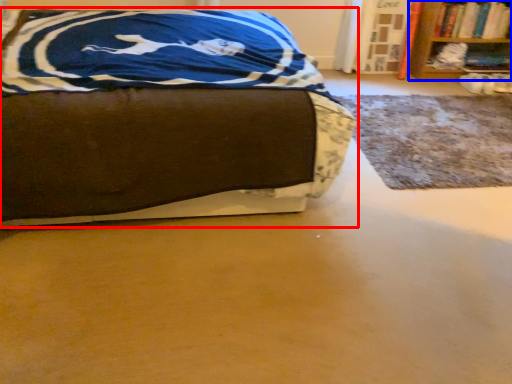
Question: Which point is closer to the camera, bed (highlighted by a red box) or bookcase (highlighted by a blue box)?

Choices:
 (A) bed
 (B) bookcase

Answer: (A)